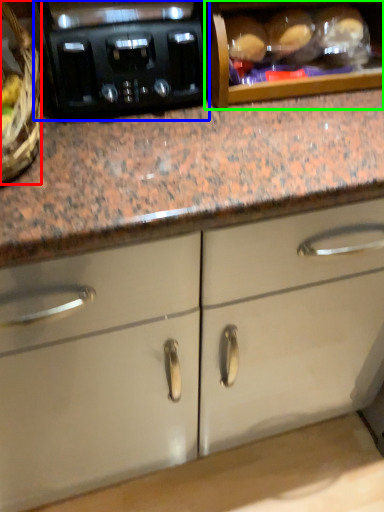
Question: Which object is positioned farthest from basket (highlighted by a red box)? Select from home appliance (highlighted by a blue box) and cabinetry (highlighted by a green box).

Choices:
 (A) home appliance
 (B) cabinetry

Answer: (B)